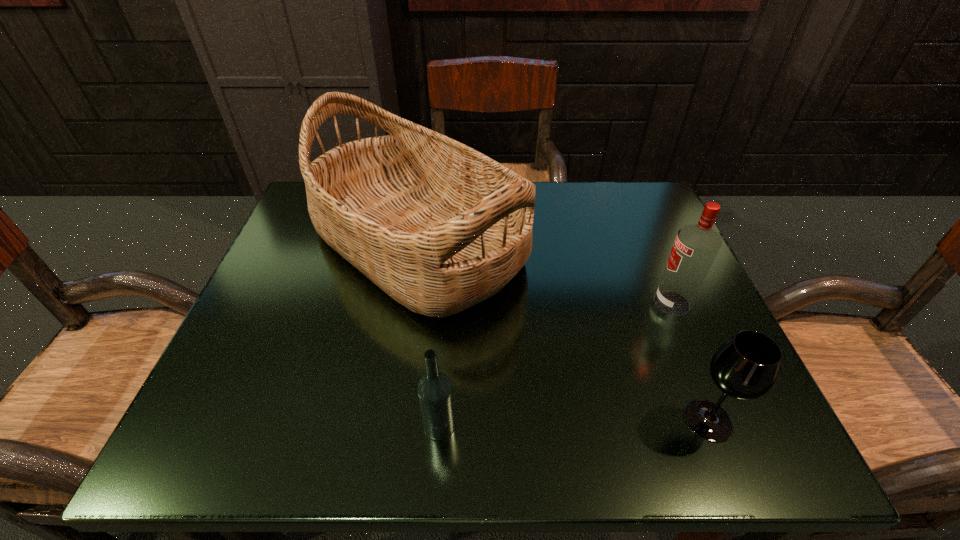
You are a GUI agent. You are given a task and a screenshot of the screen. Output one action in this format:
    pyautogui.click(x=<x>, y=<y>)
    Task: Click on the basket
    The width and height of the screenshot is (960, 540).
    Given the screenshot: What is the action you would take?
    pyautogui.click(x=438, y=226)

Locate an element on the screen. The width and height of the screenshot is (960, 540). the right vodka is located at coordinates (696, 245).

Image resolution: width=960 pixels, height=540 pixels. Identify the location of the taller vodka. (696, 245).

I want to click on wineglass, so click(745, 367).

Locate an element on the screen. The height and width of the screenshot is (540, 960). the shorter vodka is located at coordinates (435, 392).

Find the location of a particular element. The image size is (960, 540). the nearer vodka is located at coordinates (435, 392).

This screenshot has height=540, width=960. I want to click on vacant region located 0.090m on the right of the basket, so click(x=566, y=242).

You are a GUI agent. You are given a task and a screenshot of the screen. Output one action in this format:
    pyautogui.click(x=<x>, y=<y>)
    Task: Click on the free space located on the front label of the right vodka
    
    Given the screenshot: What is the action you would take?
    pyautogui.click(x=608, y=303)

This screenshot has height=540, width=960. Identify the location of vacant space located 0.340m on the front label of the right vodka. (481, 303).

Where is `vacant position located on the front label of the right vodka`? The width and height of the screenshot is (960, 540). vacant position located on the front label of the right vodka is located at coordinates (507, 303).